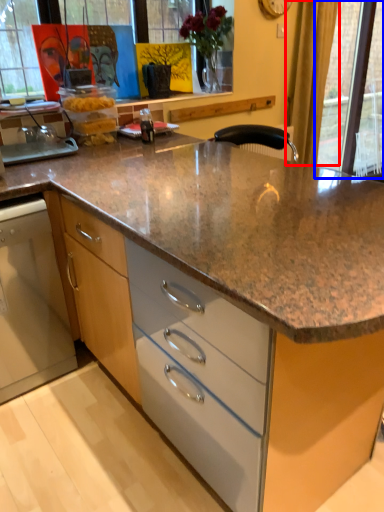
Question: Which object is closer to the camera taking this photo, curtain (highlighted by a red box) or glass door (highlighted by a blue box)?

Choices:
 (A) curtain
 (B) glass door

Answer: (A)